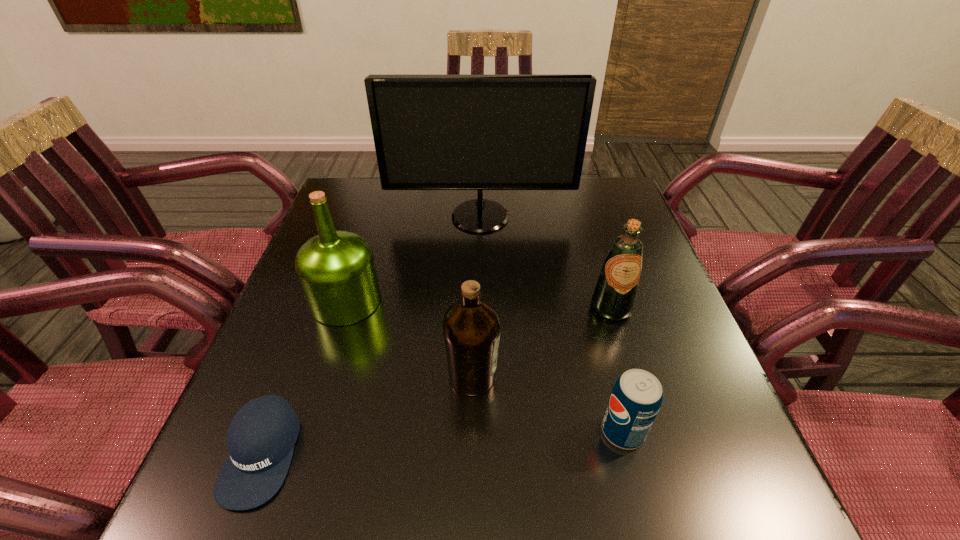
Find the location of a particular element. free space that satisfies the following two spatial constraints: 1. on the front-facing side of the computer monitor; 2. on the right side of the second shortest object is located at coordinates (481, 431).

You are a GUI agent. You are given a task and a screenshot of the screen. Output one action in this format:
    pyautogui.click(x=<x>, y=<y>)
    Task: Click on the vacant area that satisfies the following two spatial constraints: 1. on the label of the fifth tallest object; 2. on the left side of the third nearest object
    
    Given the screenshot: What is the action you would take?
    pyautogui.click(x=471, y=431)

The height and width of the screenshot is (540, 960). I want to click on vacant space that satisfies the following two spatial constraints: 1. on the label of the nearest olive oil; 2. on the back side of the pop, so click(x=471, y=431).

In order to click on vacant space that satisfies the following two spatial constraints: 1. on the front-facing side of the tallest object; 2. on the left side of the second shortest object in this screenshot , I will do `click(481, 431)`.